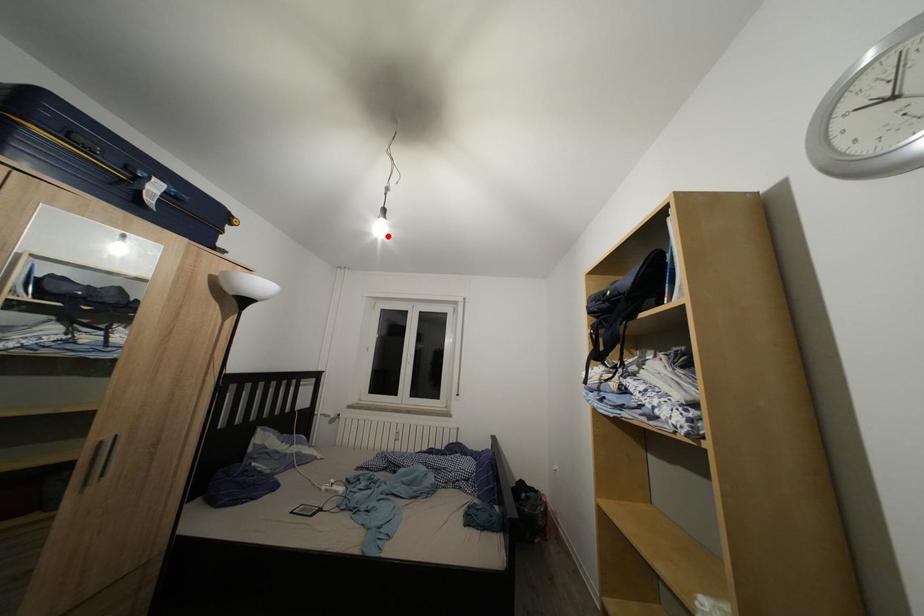
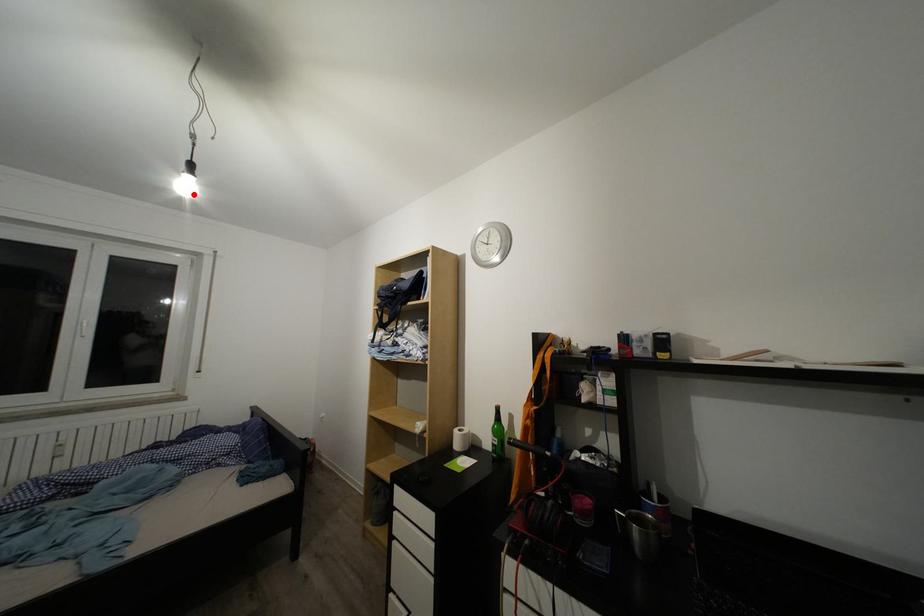
I am providing you with two images of the same scene from different viewpoints. A red point is marked on the first image and another point is marked on the second image. Does the point marked in image1 correspond to the same location as the one in image2?

Yes